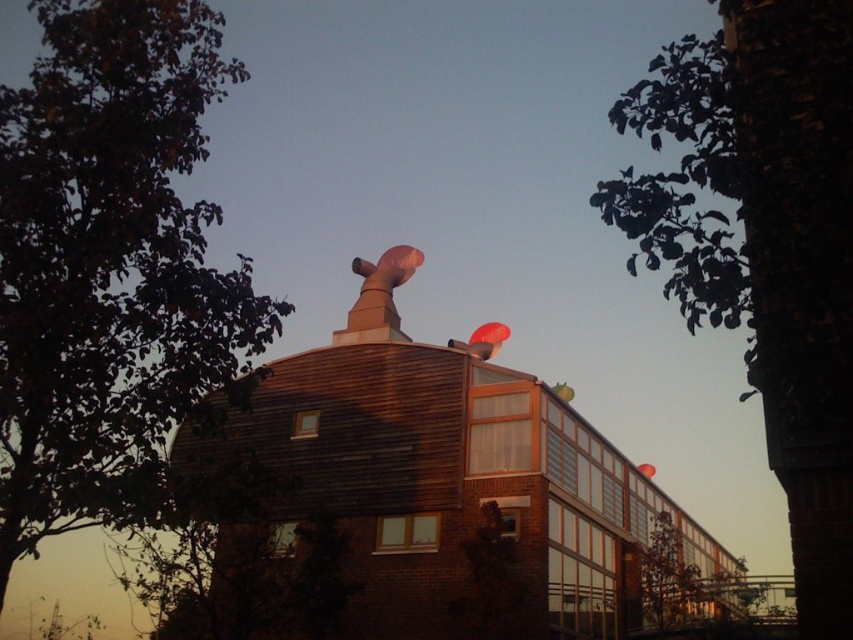
Is the position of green leafy tree at upper left more distant than that of rubberized red balloon at upper center?

No, green leafy tree at upper left is in front of rubberized red balloon at upper center.

Between green leafy tree at upper left and rubberized red balloon at upper center, which one has less height?

rubberized red balloon at upper center

The width and height of the screenshot is (853, 640). Find the location of `green leafy tree at upper left`. green leafy tree at upper left is located at coordinates (109, 264).

Where is `rubberized red balloon at upper center`? rubberized red balloon at upper center is located at coordinates (486, 339).

Is rubberized red balloon at upper center taller than rubber balloon at center?

Incorrect, rubberized red balloon at upper center's height is not larger of rubber balloon at center's.

You are a GUI agent. You are given a task and a screenshot of the screen. Output one action in this format:
    pyautogui.click(x=<x>, y=<y>)
    Task: Click on the rubberized red balloon at upper center
    This screenshot has height=640, width=853.
    Given the screenshot: What is the action you would take?
    pyautogui.click(x=486, y=339)

This screenshot has width=853, height=640. I want to click on rubberized red balloon at upper center, so click(486, 339).

Is the position of green leafy tree at upper left more distant than that of translucent plastic balloon at upper center?

No, it is not.

Which is in front, point (103, 157) or point (566, 394)?

Point (103, 157)

Who is more distant from viewer, (204, 83) or (572, 390)?

The point (572, 390) is behind.

Find the location of a particular element. The height and width of the screenshot is (640, 853). green leafy tree at upper left is located at coordinates (109, 264).